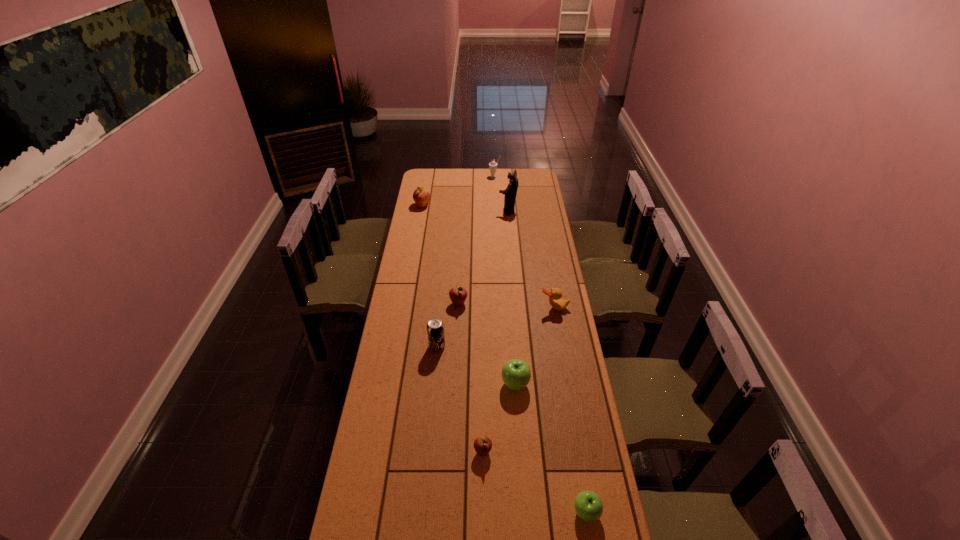
Locate an element on the screen. apple present at the right edge is located at coordinates (588, 505).

In the image, there is a desktop. Find the location of `vacant area at the far edge`. vacant area at the far edge is located at coordinates (470, 178).

At what (x,y) coordinates should I click in order to perform the action: click on free region at the left edge of the desktop. Please return your answer as a coordinate pair (x, y). Image resolution: width=960 pixels, height=540 pixels. Looking at the image, I should click on (369, 509).

Identify the location of free region at the right edge of the desktop. The height and width of the screenshot is (540, 960). (529, 274).

The image size is (960, 540). Identify the location of vacant point located between the second biggest red apple and the second nearest object. (470, 377).

Find the location of a particular element. This screenshot has width=960, height=540. free space between the nearest red apple and the third nearest object is located at coordinates (499, 417).

This screenshot has width=960, height=540. Identify the location of vacant area between the duck and the farthest apple. (489, 257).

Locate an element on the screen. The height and width of the screenshot is (540, 960). free area in between the nearest object and the duck is located at coordinates [x=570, y=410].

You are a GUI agent. You are given a task and a screenshot of the screen. Output one action in this format:
    pyautogui.click(x=<x>, y=<y>)
    Task: Click on the vacant area that lies between the fourth apple from right to left and the fourth apple from left to right
    The image size is (960, 540).
    Given the screenshot: What is the action you would take?
    pyautogui.click(x=487, y=343)

You are a GUI agent. You are given a task and a screenshot of the screen. Output one action in this format:
    pyautogui.click(x=<x>, y=<y>)
    Task: Click on the vacant area that lies between the soda can and the milkshake
    
    Given the screenshot: What is the action you would take?
    pyautogui.click(x=466, y=262)